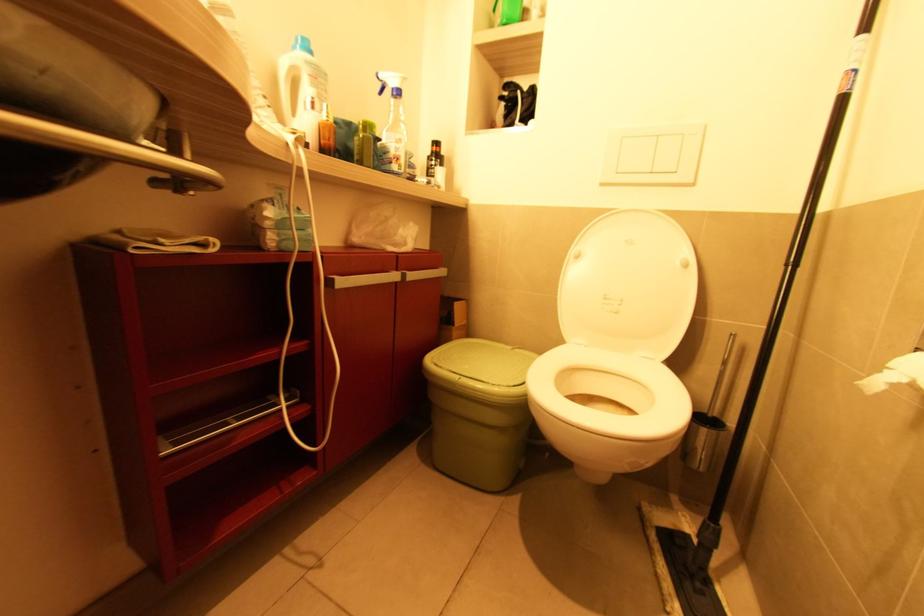
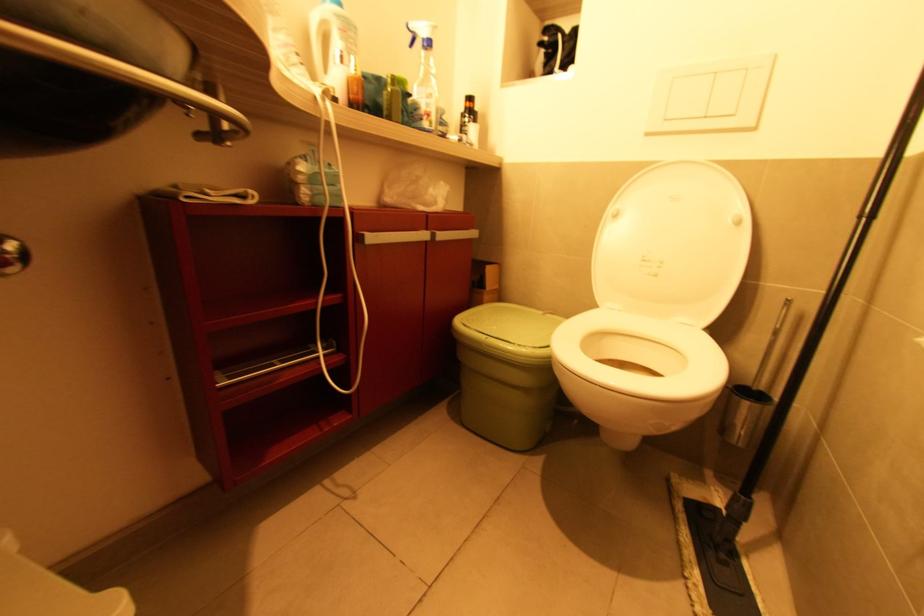
Find the pixel in the second image that matches (x=652, y=172) in the first image.

(709, 118)